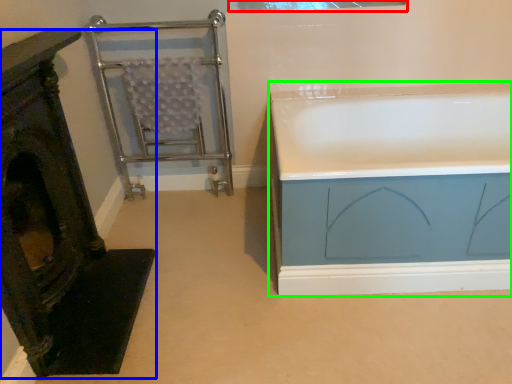
Question: Which object is the closest to the window (highlighted by a red box)? Choose among these: furniture (highlighted by a blue box) or bathtub (highlighted by a green box).

Choices:
 (A) furniture
 (B) bathtub

Answer: (B)